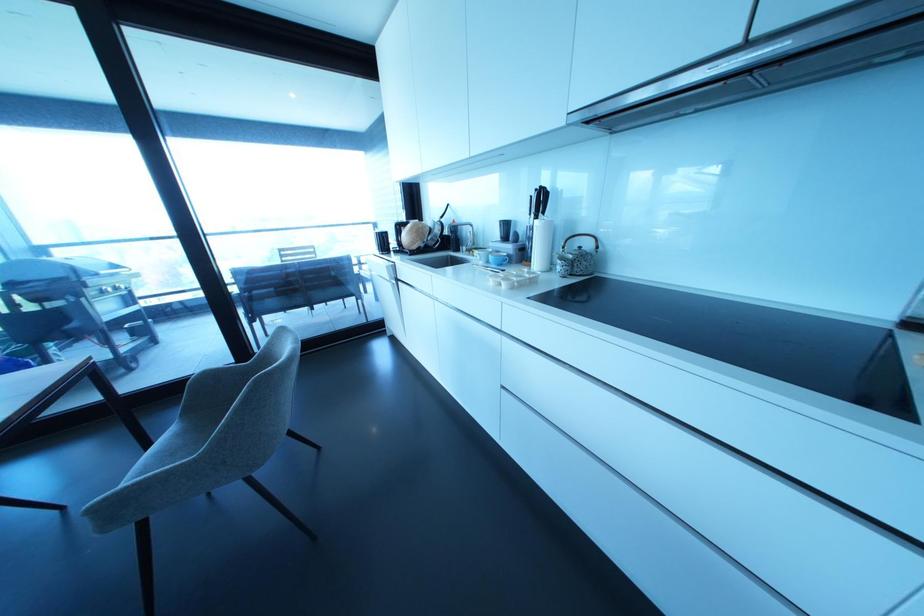
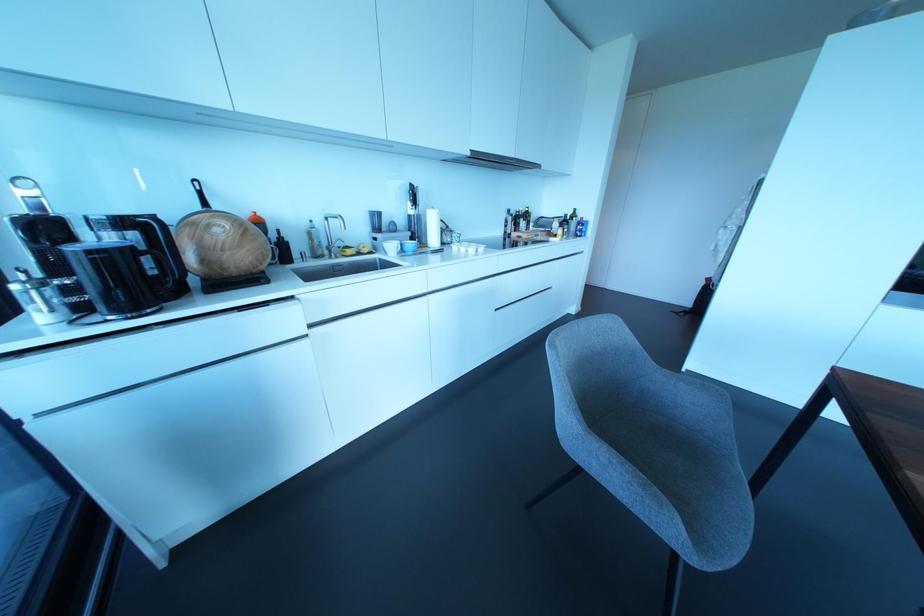
The point at (531,222) is marked in the first image. Where is the corresponding point in the second image?

(410, 211)